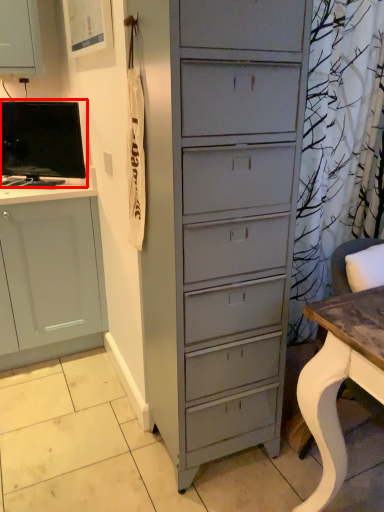
Question: From the image's perspective, where is computer monitor (annotated by the red box) located relative to desk?

Choices:
 (A) above
 (B) below

Answer: (A)